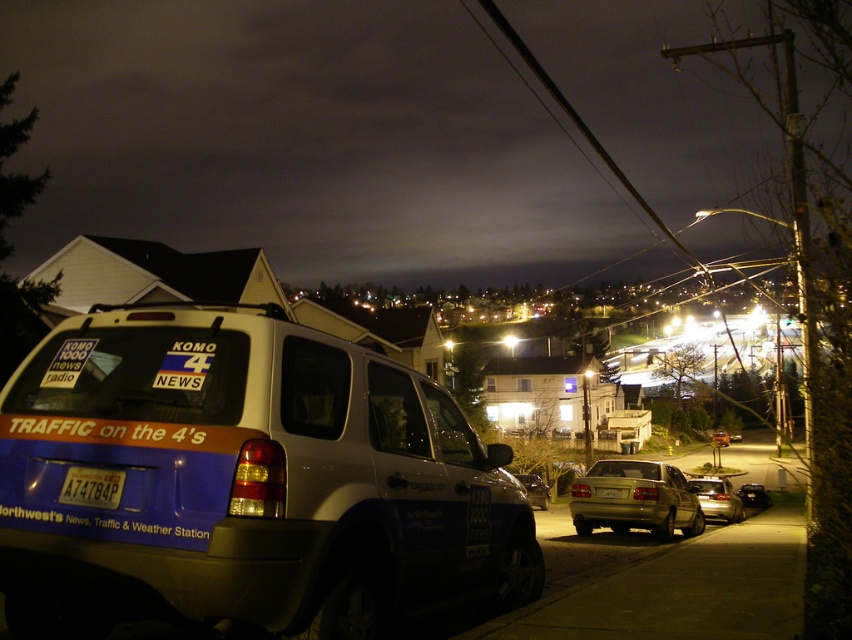
Question: Which object appears farthest from the camera in this image?

Choices:
 (A) black plastic license plate at center
 (B) white plastic license plate at center

Answer: (B)

Question: Which point is farther to the camera?

Choices:
 (A) black plastic license plate at center
 (B) silver metallic sedan at center

Answer: (B)

Question: Can you confirm if metallic gold sedan at center is wider than white plastic license plate at center?

Choices:
 (A) no
 (B) yes

Answer: (B)

Question: Is silver metallic sedan at center above white plastic license plate at center?

Choices:
 (A) no
 (B) yes

Answer: (A)

Question: Does black plastic license plate at center have a larger size compared to shiny silver sedan at center?

Choices:
 (A) no
 (B) yes

Answer: (A)

Question: Based on their relative distances, which object is farther from the metallic gold sedan at center?

Choices:
 (A) silver metallic minivan at center
 (B) white plastic license plate at center

Answer: (A)